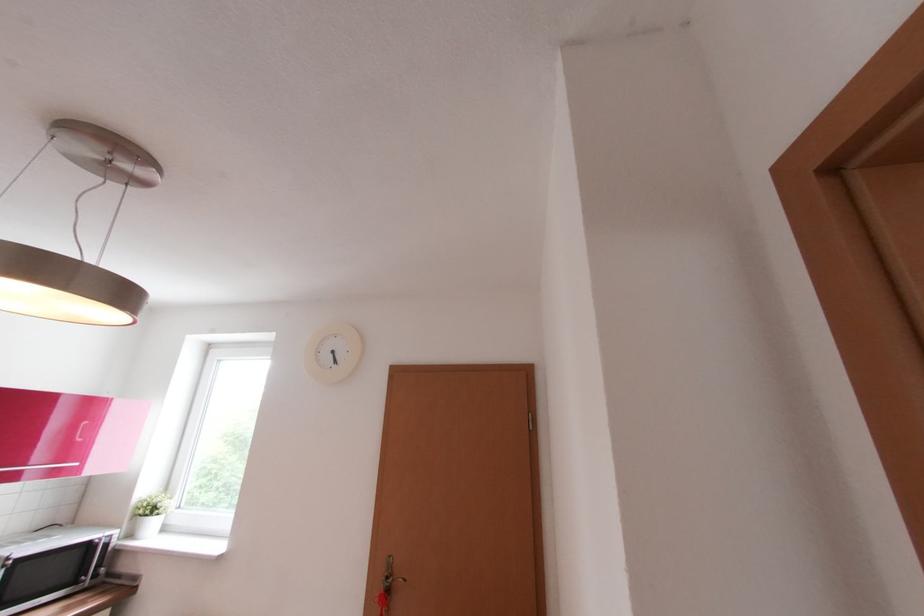
I want to click on small white pot, so (147, 525).